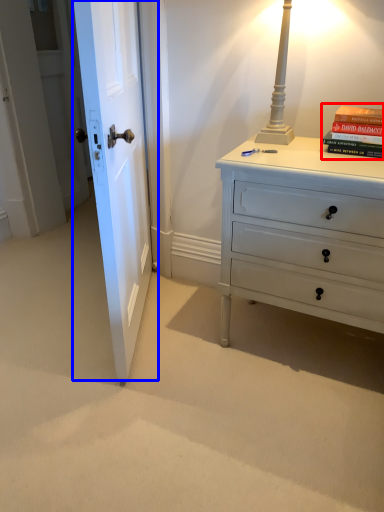
Question: Which object appears farthest to the camera in this image, paperback book (highlighted by a red box) or door (highlighted by a blue box)?

Choices:
 (A) paperback book
 (B) door

Answer: (A)